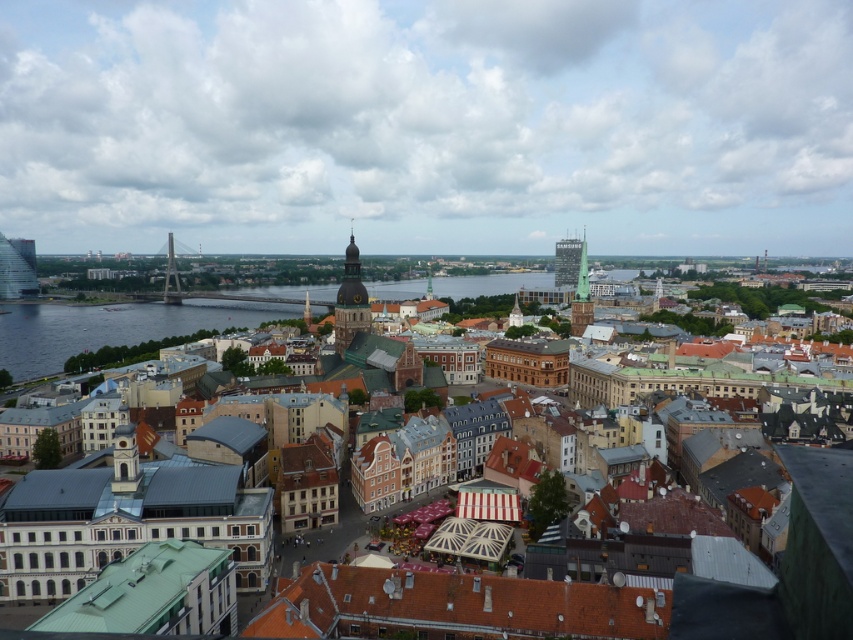
Based on the scene description, where are the brown stone buildings at center located in terms of coordinates?

The brown stone buildings at center are located at coordinates point [786,564].

You are an architect analyzing the city layout. You observe the brown stone buildings at center and the green copper tower at center. Based on their positions, which one is situated lower in the image?

The brown stone buildings at center is located below the green copper tower at center, so it is situated lower in the image.